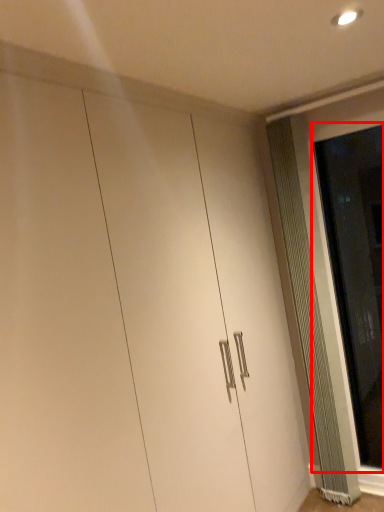
Question: From the image's perspective, where is screen door (annotated by the red box) located in relation to radiator in the image?

Choices:
 (A) above
 (B) below

Answer: (A)